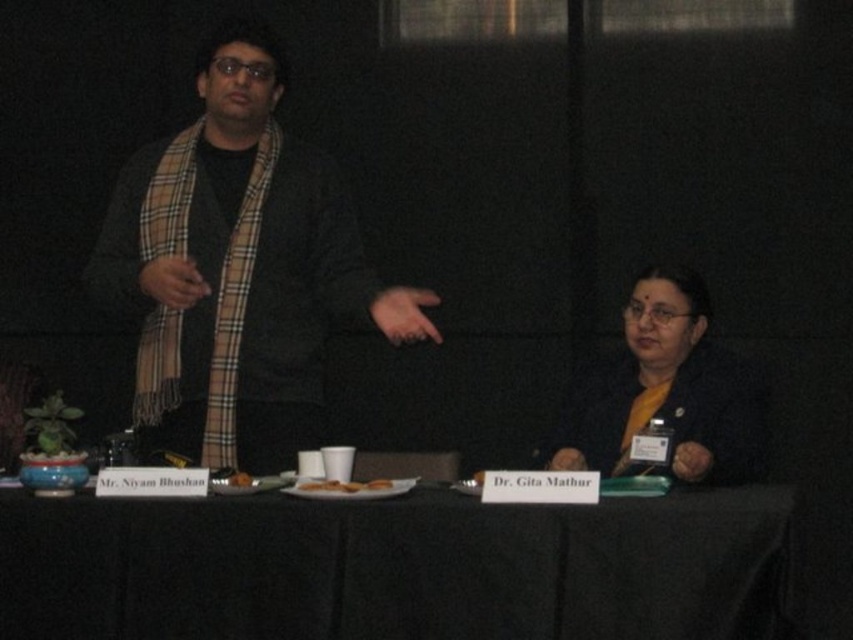
Does brown plaid scarf at left have a smaller size compared to brown matte bread at center?

No, brown plaid scarf at left is not smaller than brown matte bread at center.

Is brown plaid scarf at left to the right of brown matte bread at center from the viewer's perspective?

In fact, brown plaid scarf at left is to the left of brown matte bread at center.

Between point (312, 326) and point (341, 493), which one is positioned in front?

Point (341, 493)

At what (x,y) coordinates should I click in order to perform the action: click on brown plaid scarf at left. Please return your answer as a coordinate pair (x, y). This screenshot has height=640, width=853. Looking at the image, I should click on (236, 269).

From the picture: Can you confirm if black fabric table at lower center is thinner than brown plaid scarf at left?

No.

How much distance is there between black fabric table at lower center and brown plaid scarf at left?

A distance of 34.47 inches exists between black fabric table at lower center and brown plaid scarf at left.

Is point (521, 582) more distant than point (132, 296)?

No, (521, 582) is closer to viewer.

Where is `black fabric table at lower center`? black fabric table at lower center is located at coordinates (389, 566).

Is point (607, 387) positioned before point (236, 483)?

No, it is not.

Is yellow matte shirt at lower right positioned in front of brown crumbly cookie at center?

No, it is behind brown crumbly cookie at center.

Who is more distant from viewer, (x=708, y=312) or (x=238, y=481)?

Positioned behind is point (x=708, y=312).

Locate an element on the screen. Image resolution: width=853 pixels, height=640 pixels. yellow matte shirt at lower right is located at coordinates (666, 390).